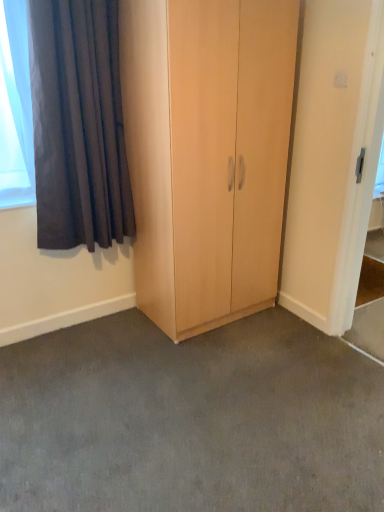
Where is `dark grey velvet curtain at upper left`? The image size is (384, 512). dark grey velvet curtain at upper left is located at coordinates (78, 125).

Describe the element at coordinates (207, 153) in the screenshot. I see `light wood cupboard at center` at that location.

Identify the location of dark grey velvet curtain at upper left. (78, 125).

Which object is wider, white glossy screen door at upper right or light wood cupboard at center?

With larger width is light wood cupboard at center.

At what (x,y) coordinates should I click in order to perform the action: click on cupboard above the white glossy screen door at upper right (from the image's perspective). Please return your answer as a coordinate pair (x, y). This screenshot has width=384, height=512. Looking at the image, I should click on (207, 153).

From the image's perspective, between white glossy screen door at upper right and light wood cupboard at center, who is located below?

From the image's view, white glossy screen door at upper right is below.

Which is closer to the camera, (379, 145) or (59, 179)?

Point (379, 145) is positioned closer to the camera compared to point (59, 179).

Considering the sizes of objects white glossy screen door at upper right and dark grey velvet curtain at upper left in the image provided, who is smaller, white glossy screen door at upper right or dark grey velvet curtain at upper left?

white glossy screen door at upper right.

Relative to dark grey velvet curtain at upper left, is white glossy screen door at upper right in front or behind?

Clearly, white glossy screen door at upper right is in front of dark grey velvet curtain at upper left.

From a real-world perspective, is white glossy screen door at upper right beneath dark grey velvet curtain at upper left?

Correct, in the physical world, white glossy screen door at upper right is lower than dark grey velvet curtain at upper left.

Which of these two, dark grey velvet curtain at upper left or gray carpet at center, is wider?

gray carpet at center.

From the image's perspective, is dark grey velvet curtain at upper left above or below gray carpet at center?

Based on their image positions, dark grey velvet curtain at upper left is located above gray carpet at center.

Does point (104, 131) appear closer or farther from the camera than point (175, 435)?

Clearly, point (104, 131) is more distant from the camera than point (175, 435).

I want to click on screen door located on the right of gray carpet at center, so click(x=360, y=178).

Is white glossy screen door at upper right oriented towards gray carpet at center?

Yes, white glossy screen door at upper right is facing gray carpet at center.

Is gray carpet at center with dark grey velvet curtain at upper left?

There is a gap between gray carpet at center and dark grey velvet curtain at upper left.

This screenshot has height=512, width=384. I want to click on curtain above the gray carpet at center (from the image's perspective), so click(78, 125).

From a real-world perspective, is gray carpet at center positioned over dark grey velvet curtain at upper left based on gravity?

No.

This screenshot has width=384, height=512. Find the location of `cupboard on the left of white glossy screen door at upper right`. cupboard on the left of white glossy screen door at upper right is located at coordinates (207, 153).

Does light wood cupboard at center have a lesser width compared to white glossy screen door at upper right?

No, light wood cupboard at center is not thinner than white glossy screen door at upper right.

Can you confirm if light wood cupboard at center is positioned to the right of white glossy screen door at upper right?

In fact, light wood cupboard at center is to the left of white glossy screen door at upper right.

Based on the photo, from a real-world perspective, which is physically below, light wood cupboard at center or white glossy screen door at upper right?

white glossy screen door at upper right, from a real-world perspective.

Does dark grey velvet curtain at upper left have a greater height compared to white glossy screen door at upper right?

Incorrect, the height of dark grey velvet curtain at upper left is not larger of that of white glossy screen door at upper right.

How distant is dark grey velvet curtain at upper left from white glossy screen door at upper right?

dark grey velvet curtain at upper left and white glossy screen door at upper right are 4.41 feet apart from each other.

Can you see dark grey velvet curtain at upper left touching white glossy screen door at upper right?

No, dark grey velvet curtain at upper left is not touching white glossy screen door at upper right.

Looking at the image, does dark grey velvet curtain at upper left seem bigger or smaller compared to white glossy screen door at upper right?

Considering their sizes, dark grey velvet curtain at upper left takes up more space than white glossy screen door at upper right.

Image resolution: width=384 pixels, height=512 pixels. Find the location of `screen door on the right side of light wood cupboard at center`. screen door on the right side of light wood cupboard at center is located at coordinates (360, 178).

The height and width of the screenshot is (512, 384). There is a white glossy screen door at upper right. In order to click on curtain above it (from a real-world perspective) in this screenshot , I will do `click(78, 125)`.

Which object lies further to the anchor point gray carpet at center, dark grey velvet curtain at upper left or white glossy screen door at upper right?

The object further to gray carpet at center is dark grey velvet curtain at upper left.

Looking at the image, which one is located further to gray carpet at center, light wood cupboard at center or white glossy screen door at upper right?

white glossy screen door at upper right is further to gray carpet at center.

Estimate the real-world distances between objects in this image. Which object is further from light wood cupboard at center, gray carpet at center or dark grey velvet curtain at upper left?

gray carpet at center lies further to light wood cupboard at center than the other object.

Based on their spatial positions, is gray carpet at center or white glossy screen door at upper right closer to dark grey velvet curtain at upper left?

gray carpet at center is closer to dark grey velvet curtain at upper left.

When comparing their distances from dark grey velvet curtain at upper left, does white glossy screen door at upper right or light wood cupboard at center seem further?

white glossy screen door at upper right is positioned further to the anchor dark grey velvet curtain at upper left.

When comparing their distances from gray carpet at center, does white glossy screen door at upper right or dark grey velvet curtain at upper left seem closer?

white glossy screen door at upper right is positioned closer to the anchor gray carpet at center.

From the picture: Looking at the image, which one is located further to white glossy screen door at upper right, gray carpet at center or dark grey velvet curtain at upper left?

Answer: dark grey velvet curtain at upper left is further to white glossy screen door at upper right.

From the image, which object appears to be nearer to gray carpet at center, light wood cupboard at center or dark grey velvet curtain at upper left?

The object closer to gray carpet at center is light wood cupboard at center.

I want to click on cupboard that lies between dark grey velvet curtain at upper left and gray carpet at center from top to bottom, so click(x=207, y=153).

Where is `cupboard between dark grey velvet curtain at upper left and white glossy screen door at upper right in the horizontal direction`? cupboard between dark grey velvet curtain at upper left and white glossy screen door at upper right in the horizontal direction is located at coordinates (207, 153).

Where is `screen door that lies between light wood cupboard at center and gray carpet at center from top to bottom`? The image size is (384, 512). screen door that lies between light wood cupboard at center and gray carpet at center from top to bottom is located at coordinates (360, 178).

At what (x,y) coordinates should I click in order to perform the action: click on concrete between dark grey velvet curtain at upper left and white glossy screen door at upper right in the horizontal direction. Please return your answer as a coordinate pair (x, y). The height and width of the screenshot is (512, 384). Looking at the image, I should click on (190, 419).